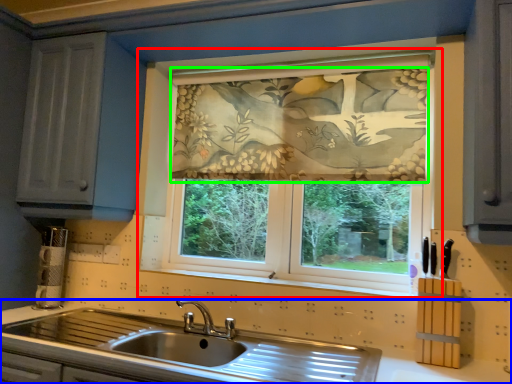
Question: Based on their relative distances, which object is farther from window (highlighted by a red box)? Choose from countertop (highlighted by a blue box) and curtain (highlighted by a green box).

Choices:
 (A) countertop
 (B) curtain

Answer: (A)